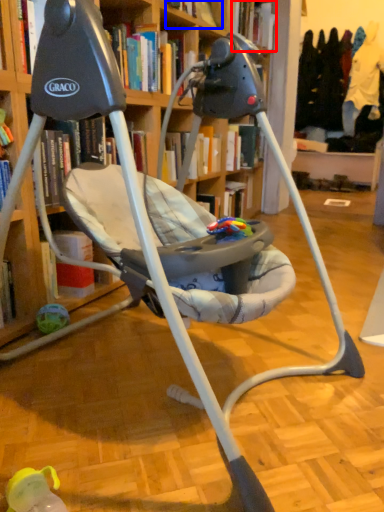
Question: Which object appears closest to the camera in this image, book (highlighted by a red box) or book (highlighted by a blue box)?

Choices:
 (A) book
 (B) book

Answer: (B)